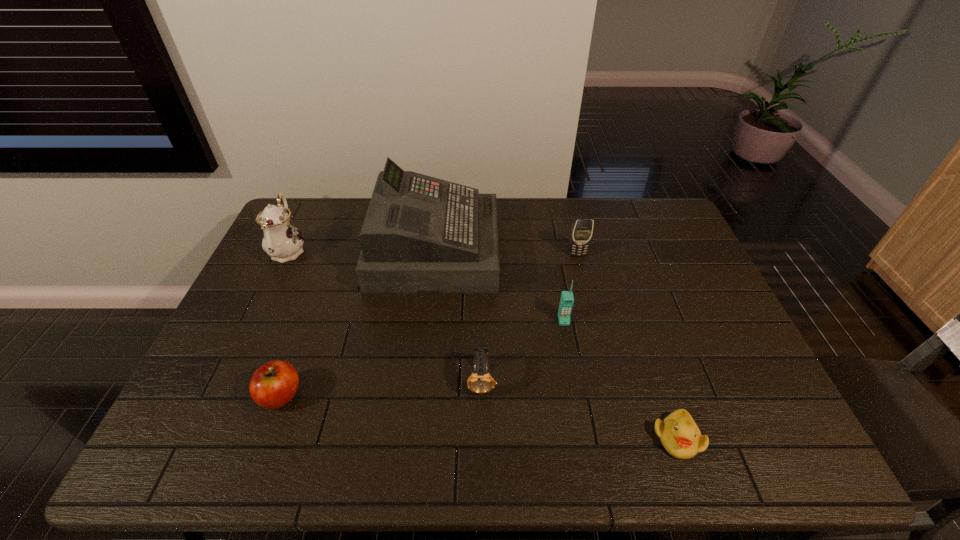
Identify the location of object located at the left edge. (282, 241).

This screenshot has width=960, height=540. Identify the location of object situated at the far left corner. (282, 241).

At what (x,y) coordinates should I click in order to perform the action: click on vacant space at the far edge. Please return your answer as a coordinate pair (x, y). Looking at the image, I should click on (598, 234).

Where is `vacant position at the near edge of the desktop`? vacant position at the near edge of the desktop is located at coordinates (721, 466).

Locate an element on the screen. The height and width of the screenshot is (540, 960). blank area at the left edge is located at coordinates (252, 305).

Where is `vacant space at the far right corner of the desktop`? vacant space at the far right corner of the desktop is located at coordinates (671, 225).

In order to click on free point between the second object from left to right and the watch in this screenshot , I will do `click(381, 388)`.

Where is `free space between the watch and the tallest object`? free space between the watch and the tallest object is located at coordinates (458, 315).

In order to click on vacant area between the nearer cellular telephone and the right cellular telephone in this screenshot , I will do `click(570, 287)`.

Where is `empty space between the sixth object from left to right and the nearest object`? empty space between the sixth object from left to right and the nearest object is located at coordinates tap(627, 346).